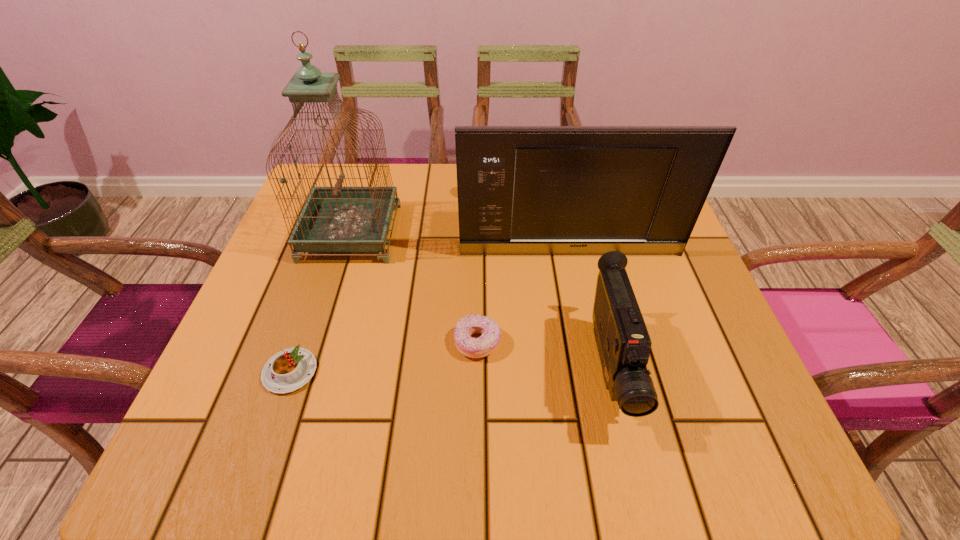
I want to click on free space at the near right corner of the desktop, so click(735, 467).

Locate an element on the screen. vacant space that's between the fourth tallest object and the third shortest object is located at coordinates (543, 355).

Locate an element on the screen. This screenshot has width=960, height=540. vacant space in between the microwave oven and the shortest object is located at coordinates (430, 313).

The width and height of the screenshot is (960, 540). I want to click on free space between the camcorder and the birdcage, so click(x=480, y=300).

Where is `blank region between the pudding and the birdcage`? This screenshot has width=960, height=540. blank region between the pudding and the birdcage is located at coordinates point(321,302).

At what (x,y) coordinates should I click in order to perform the action: click on free space between the doughnut and the camcorder. Please return your answer as a coordinate pair (x, y). The image size is (960, 540). Looking at the image, I should click on (543, 355).

At what (x,y) coordinates should I click in order to perform the action: click on empty space between the pudding and the doughnut. Please return your answer as a coordinate pair (x, y). This screenshot has width=960, height=540. Looking at the image, I should click on (384, 357).

Where is `free area in between the microwave oven and the camcorder`? The height and width of the screenshot is (540, 960). free area in between the microwave oven and the camcorder is located at coordinates (589, 310).

Locate which object is the closest to the second shortest object. Please provide its 2D coordinates. Your answer should be formatted as a tuple, i.e. [(x, y)], where the tuple contains the x and y coordinates of a point satisfying the conditions above.

[(623, 342)]

Locate an element on the screen. This screenshot has height=540, width=960. object that can be found as the third closest to the fourth shortest object is located at coordinates (484, 345).